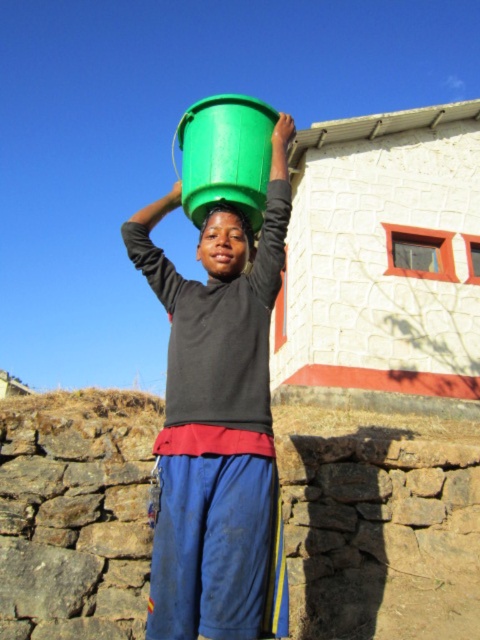
Question: Which point is farther from the camera taking this photo?

Choices:
 (A) (186, 520)
 (B) (216, 259)

Answer: (B)

Question: Considering the relative positions of green plastic bucket at center and matte green bucket at upper center in the image provided, where is green plastic bucket at center located with respect to matte green bucket at upper center?

Choices:
 (A) right
 (B) left

Answer: (B)

Question: Where is green plastic bucket at center located in relation to matte green bucket at upper center in the image?

Choices:
 (A) left
 (B) right

Answer: (A)

Question: Is green plastic bucket at center wider than matte green bucket at upper center?

Choices:
 (A) yes
 (B) no

Answer: (A)